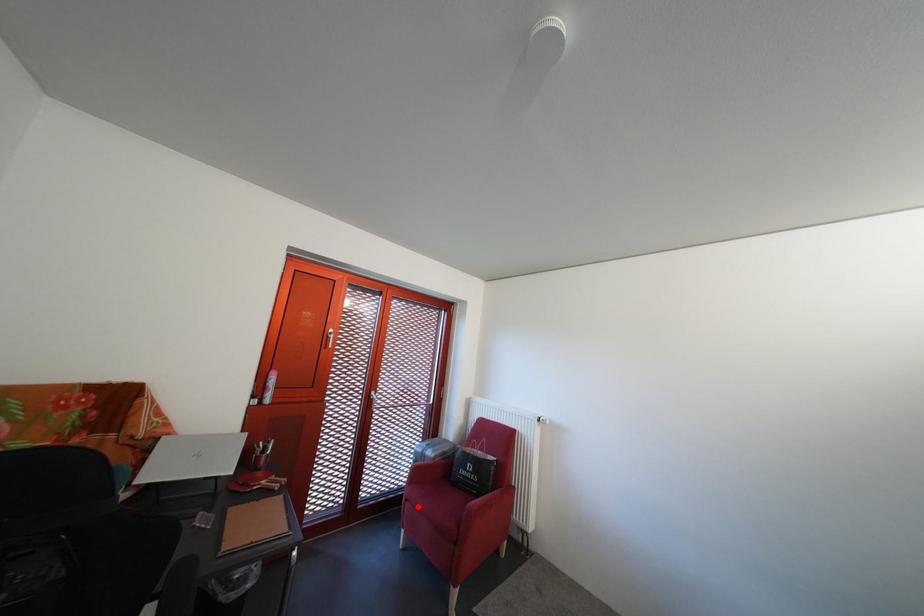
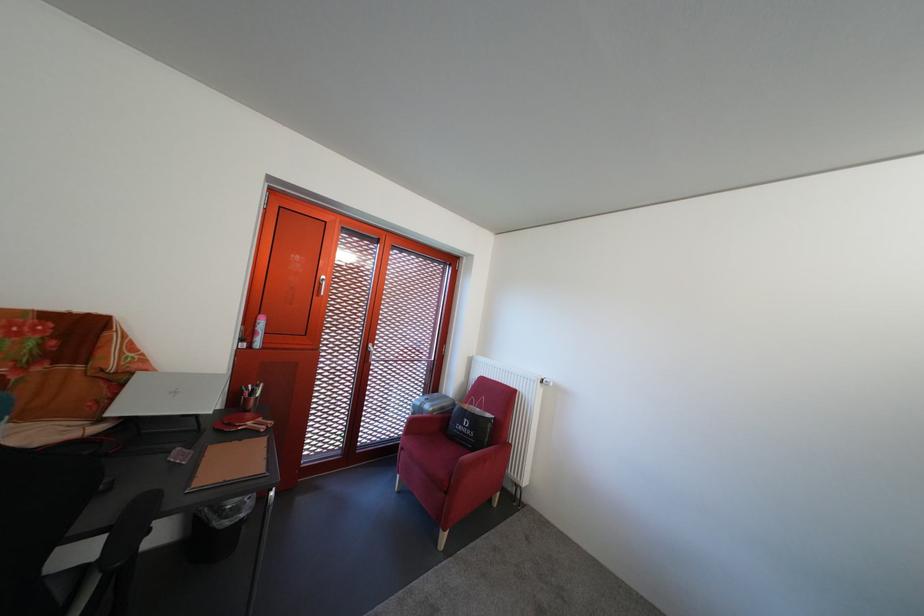
Where in the second image is the point corresponding to the highlighted location from the first image?

(412, 456)